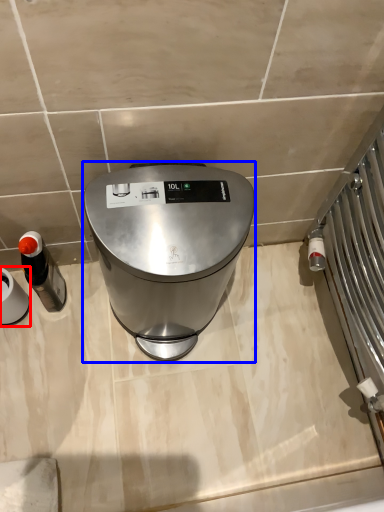
Question: Which of the following is the closest to the observer, appliance (highlighted by a red box) or home appliance (highlighted by a blue box)?

Choices:
 (A) appliance
 (B) home appliance

Answer: (B)